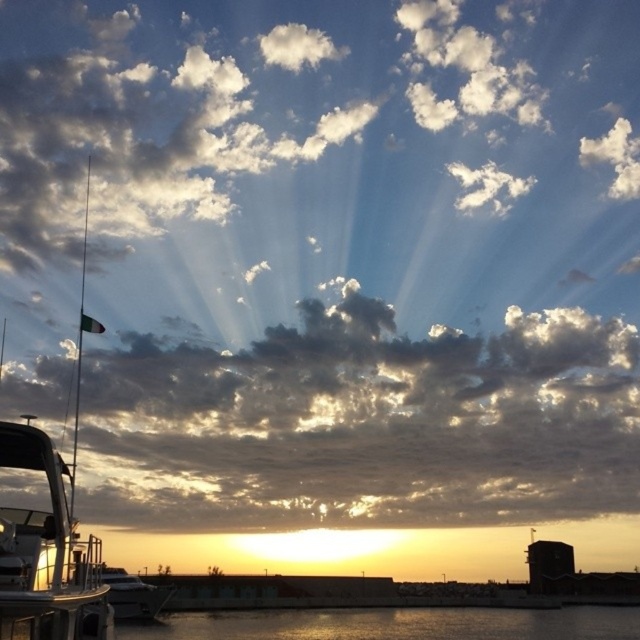
Does cloudy sky at left have a lesser width compared to shiny silver boat at lower left?

In fact, cloudy sky at left might be wider than shiny silver boat at lower left.

Is cloudy sky at left shorter than shiny silver boat at lower left?

No.

Find the location of a particular element. cloudy sky at left is located at coordinates (364, 422).

Find the location of a particular element. This screenshot has height=640, width=640. shiny silver boat at left is located at coordinates (44, 547).

Is shiny silver boat at left closer to camera compared to shiny silver boat at lower left?

Yes, shiny silver boat at left is in front of shiny silver boat at lower left.

Locate an element on the screen. shiny silver boat at left is located at coordinates (44, 547).

Identify the location of shiny silver boat at left. Image resolution: width=640 pixels, height=640 pixels. (44, 547).

Is glistening silver water at lower center bigger than shiny silver boat at lower left?

Yes.

Which is above, glistening silver water at lower center or shiny silver boat at lower left?

shiny silver boat at lower left

This screenshot has width=640, height=640. Find the location of `glistening silver water at lower center`. glistening silver water at lower center is located at coordinates click(396, 624).